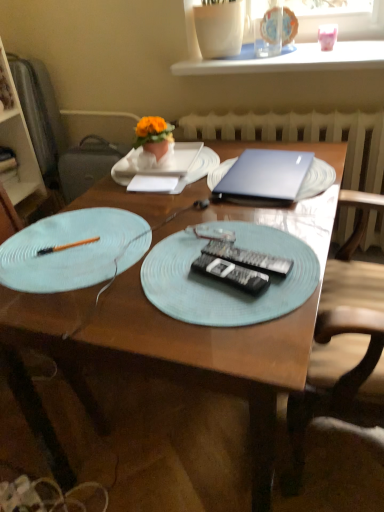
You are a GUI agent. You are given a task and a screenshot of the screen. Output one action in this format:
    pyautogui.click(x=<x>, y=<y>)
    Task: Click on the vacant space that is in between black plastic remote control at center, placed as the 2th remote control when sorted from bottom to top, and light blue textured plate at left, placed as the second plate when sorted from front to back
    The height and width of the screenshot is (512, 384).
    Given the screenshot: What is the action you would take?
    pyautogui.click(x=181, y=261)